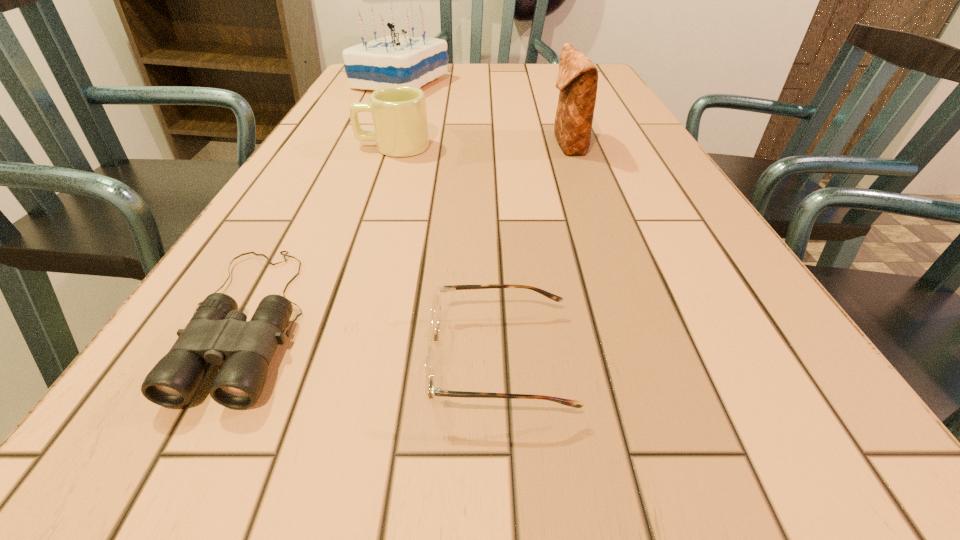
Identify the location of vacant space positioned with the handle on the side of the third tallest object. This screenshot has height=540, width=960. (321, 147).

At what (x,y) coordinates should I click in order to perform the action: click on vacant space situated on the front-facing side of the second object from right to left. Please return your answer as a coordinate pair (x, y). Looking at the image, I should click on (215, 360).

This screenshot has height=540, width=960. What are the coordinates of `free spot located on the front-facing side of the second object from right to left` in the screenshot? It's located at (305, 360).

You are a GUI agent. You are given a task and a screenshot of the screen. Output one action in this format:
    pyautogui.click(x=<x>, y=<y>)
    Task: Click on the vacant region located 0.120m on the front-facing side of the second object from right to left
    This screenshot has height=540, width=960.
    Given the screenshot: What is the action you would take?
    pyautogui.click(x=330, y=360)

Where is `vacant region located 0.080m at the eyepiece of the binoculars`? vacant region located 0.080m at the eyepiece of the binoculars is located at coordinates coord(160,485).

Find the location of `object located at the far edge`. object located at the far edge is located at coordinates (394, 60).

Find the location of `birthday cake at the left edge`. birthday cake at the left edge is located at coordinates (394, 60).

Where is `mug that is at the left edge`? Image resolution: width=960 pixels, height=540 pixels. mug that is at the left edge is located at coordinates (399, 114).

The height and width of the screenshot is (540, 960). Identify the location of binoculars that is at the left edge. (217, 333).

Locate an element on the screen. object located in the right edge section of the desktop is located at coordinates [577, 80].